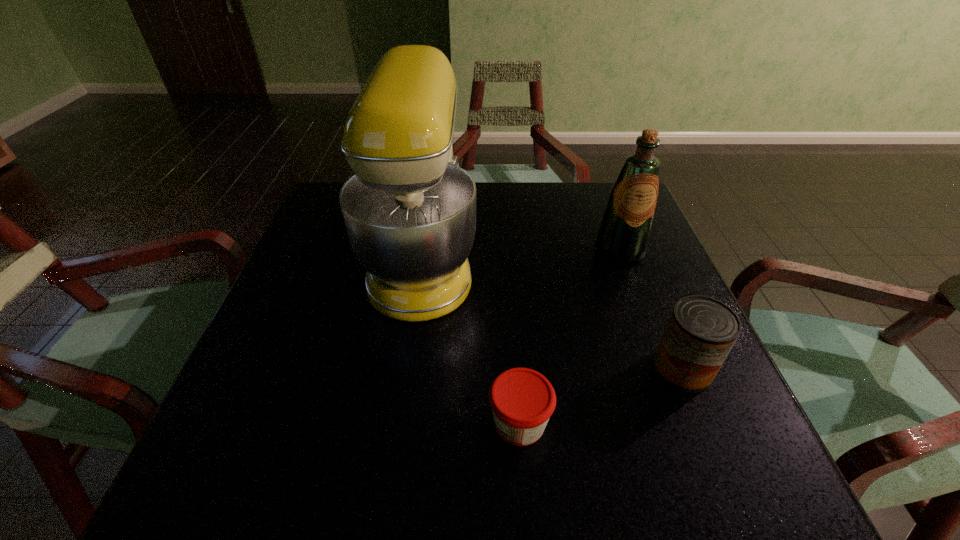
The image size is (960, 540). Identify the location of the leftmost object. pos(410,211).

The height and width of the screenshot is (540, 960). Find the location of `the tallest object`. the tallest object is located at coordinates (410, 211).

At what (x,y) coordinates should I click in order to perform the action: click on the second tallest object. Please return your answer as a coordinate pair (x, y). The height and width of the screenshot is (540, 960). Looking at the image, I should click on (623, 237).

Locate an element on the screen. the second nearest object is located at coordinates (701, 331).

I want to click on the second shortest object, so click(x=701, y=331).

Locate an element on the screen. The image size is (960, 540). the third object from right to left is located at coordinates (522, 400).

Find the location of `jam`. jam is located at coordinates (x=522, y=400).

Where is `free region located on the side of the leftmost object with the control knob`? This screenshot has height=540, width=960. free region located on the side of the leftmost object with the control knob is located at coordinates (534, 259).

I want to click on free space located on the front-facing side of the third shortest object, so click(644, 315).

Find the location of `blank area located 0.060m on the back of the can`. blank area located 0.060m on the back of the can is located at coordinates (663, 322).